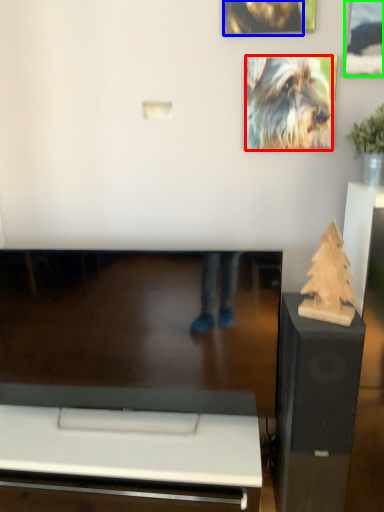
Question: Estimate the real-world distances between objects in this image. Which object is closer to dog (highlighted by a red box), dog (highlighted by a blue box) or picture frame (highlighted by a green box)?

Choices:
 (A) dog
 (B) picture frame

Answer: (B)